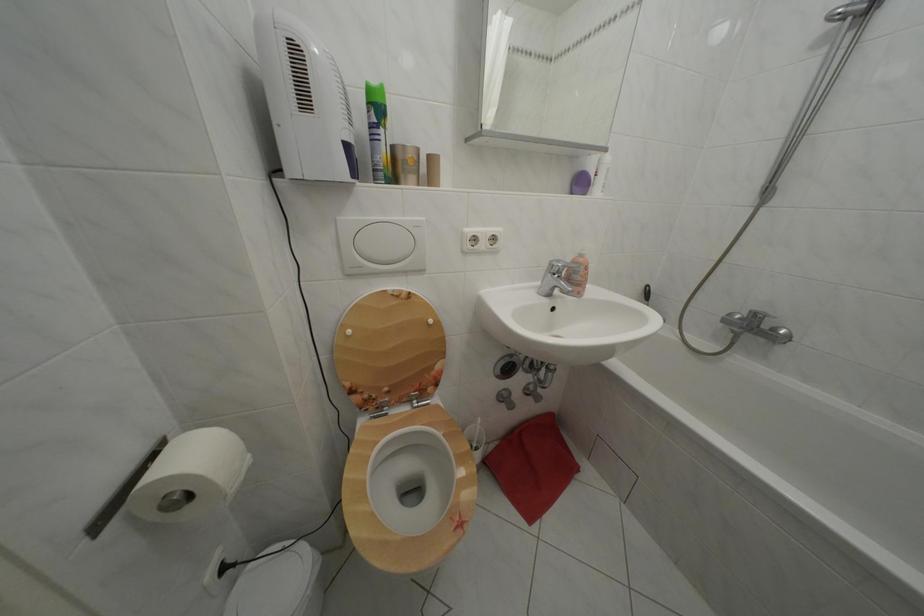
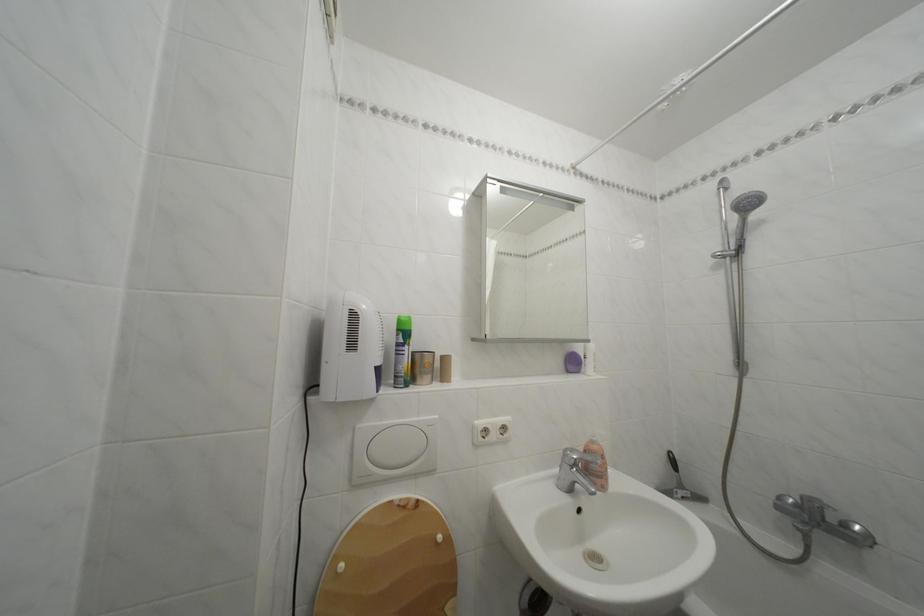
Locate, in the second image, the point that corresponds to point (358, 338) in the first image.

(350, 573)